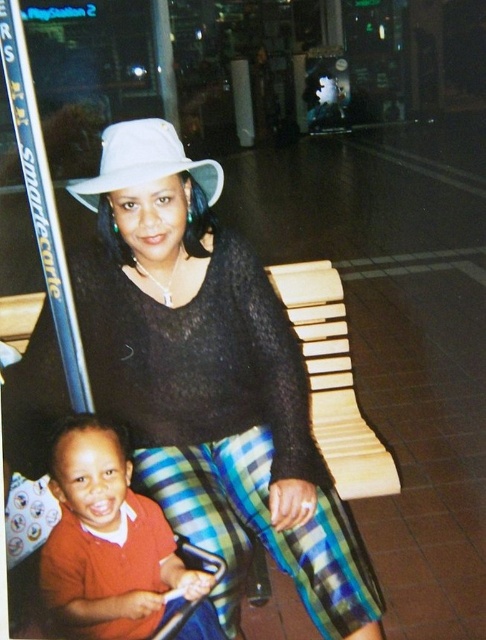
You are a delivery robot with a package that measures 32 inches in length. You need to place it between the matte orange shirt at lower left and the white matte baseball hat at upper center. Is there enough space for the package?

The distance between the matte orange shirt at lower left and the white matte baseball hat at upper center is 30.38 inches. Since the package is 32 inches long, it will not fit in the available space.

You are standing in the shopping mall and see two people sitting on a bench. You want to give a gift to the person wearing the matte orange shirt at lower left. Which direction should you approach from relative to the matte black sweater at center?

You should approach from the left side of the matte black sweater at center because the matte orange shirt at lower left is positioned to the left of it.

From the picture: You are a photographer setting up a shoot in a dimly lit indoor space. You have two subjects wearing a matte black sweater at center and a matte orange shirt at lower left. Based on their clothing widths, which subject would you recommend positioning closer to the light source to ensure their outfit is well illuminated?

The matte black sweater at center has a greater width than the matte orange shirt at lower left, so positioning the subject wearing the matte black sweater at center closer to the light source would ensure their wider outfit is adequately illuminated.